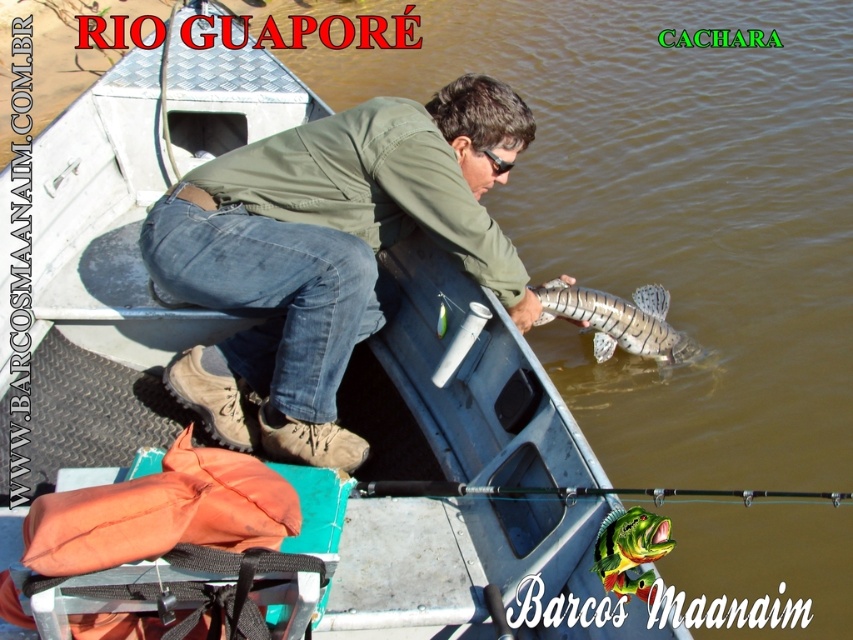
Can you confirm if green matte jacket at center is thinner than green shiny fish at center?

No, green matte jacket at center is not thinner than green shiny fish at center.

Who is more distant from viewer, [194,182] or [642,541]?

The point [194,182] is behind.

You are a GUI agent. You are given a task and a screenshot of the screen. Output one action in this format:
    pyautogui.click(x=<x>, y=<y>)
    Task: Click on the green matte jacket at center
    Image resolution: width=853 pixels, height=640 pixels.
    Given the screenshot: What is the action you would take?
    pyautogui.click(x=328, y=252)

Is shiny silver fish at center taller than green shiny fish at center?

Yes.

Is point (614, 332) behind point (598, 534)?

Yes, point (614, 332) is farther from viewer.

This screenshot has height=640, width=853. In order to click on shiny silver fish at center in this screenshot , I will do `click(619, 321)`.

Is green matte jacket at center closer to the viewer compared to black matte fishing pole at center?

No, green matte jacket at center is further to the viewer.

Which is more to the right, green matte jacket at center or black matte fishing pole at center?

black matte fishing pole at center

Who is more forward, [183,228] or [840,499]?

Point [840,499]

The image size is (853, 640). Identify the location of green matte jacket at center. (328, 252).